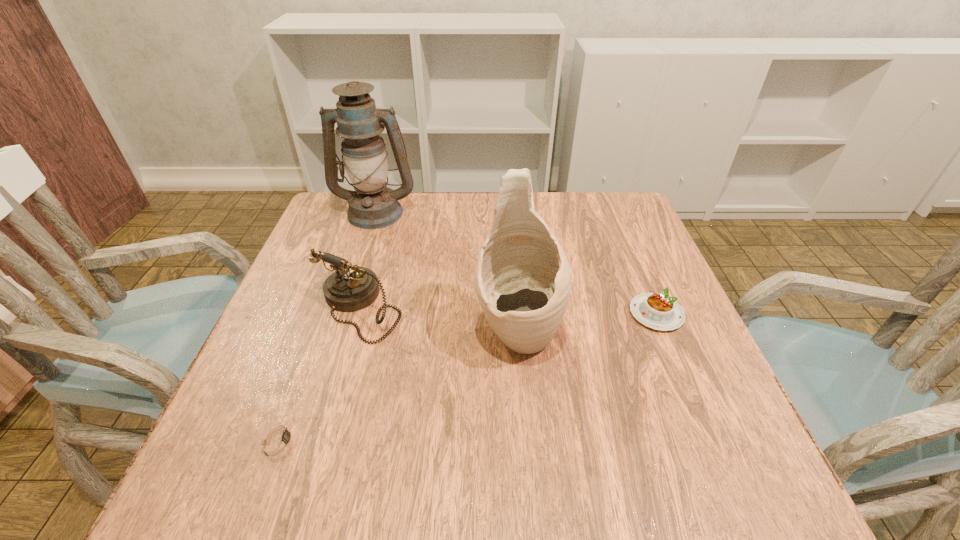
Image resolution: width=960 pixels, height=540 pixels. I want to click on vacant region at the far edge of the desktop, so click(x=453, y=215).

Identify the location of vacant region at the near edge of the desktop. (529, 495).

At what (x,y) coordinates should I click in order to perform the action: click on free space at the left edge. Please return your answer as a coordinate pair (x, y). This screenshot has width=960, height=540. Looking at the image, I should click on (310, 269).

In the image, there is a desktop. Where is `vacant space at the right edge`? vacant space at the right edge is located at coordinates (650, 250).

Where is `vacant space at the far left corner of the desktop`? vacant space at the far left corner of the desktop is located at coordinates (338, 232).

Locate an element on the screen. Image resolution: width=960 pixels, height=540 pixels. free space at the far right corner of the desktop is located at coordinates (630, 240).

Where is `free spot between the oil lamp and the telephone`? The image size is (960, 540). free spot between the oil lamp and the telephone is located at coordinates (367, 260).

Locate an element on the screen. free spot between the pitcher and the third shortest object is located at coordinates (438, 321).

Find the location of `vacant area between the shortest object and the pudding`. vacant area between the shortest object and the pudding is located at coordinates (468, 376).

Identify the location of vacant space that's between the pitcher and the telephone. This screenshot has height=540, width=960. (438, 321).